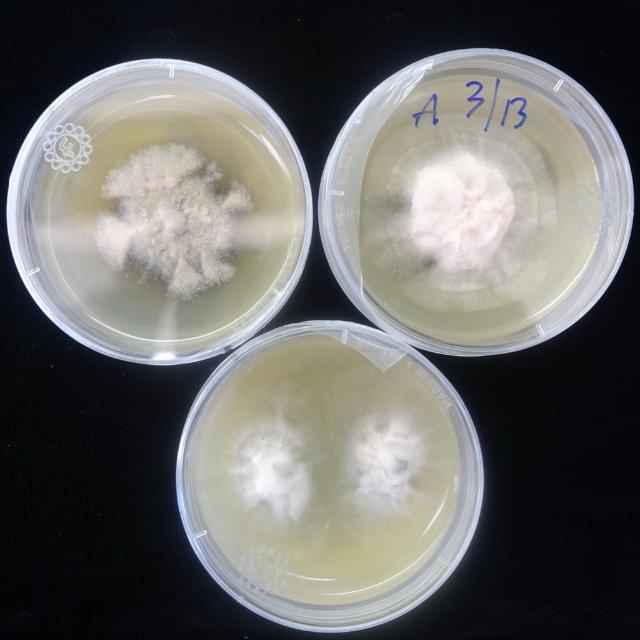
You are a microbiologist examining the top left petri dish. You need to determine the location of the white fluffy substance at center relative to the dish. Is it closer to the edge or the center?

The white fluffy substance at center is located at point (324, 468), which is near the center of the dish. Therefore, it is closer to the center than the edge.